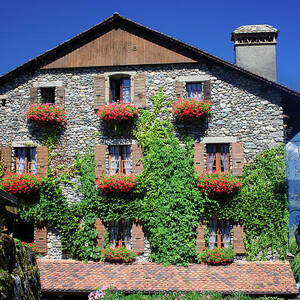
Where is `tiles`? tiles is located at coordinates (131, 278).